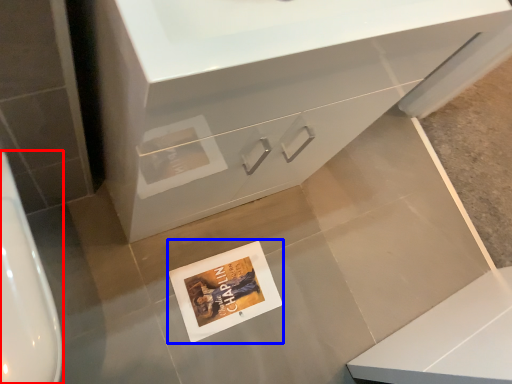
Question: Which object is further to the camera taking this photo, urinal (highlighted by a red box) or postcard (highlighted by a blue box)?

Choices:
 (A) urinal
 (B) postcard

Answer: (B)